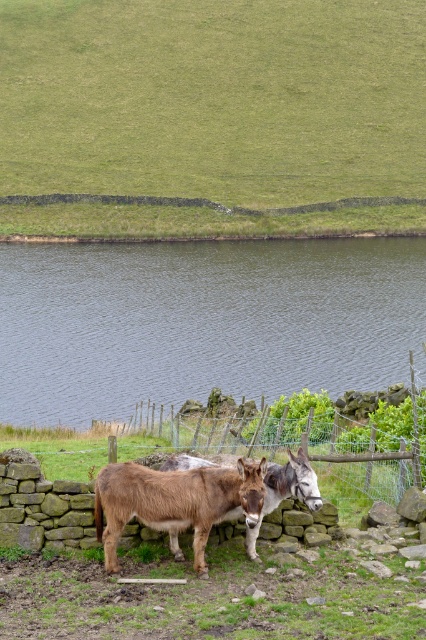
Who is positioned more to the right, brown fuzzy mule at center or brown fuzzy donkey at center?

From the viewer's perspective, brown fuzzy donkey at center appears more on the right side.

Can you confirm if brown fuzzy mule at center is taller than brown fuzzy donkey at center?

Indeed, brown fuzzy mule at center has a greater height compared to brown fuzzy donkey at center.

The width and height of the screenshot is (426, 640). What do you see at coordinates (175, 500) in the screenshot?
I see `brown fuzzy mule at center` at bounding box center [175, 500].

You are a GUI agent. You are given a task and a screenshot of the screen. Output one action in this format:
    pyautogui.click(x=<x>, y=<y>)
    Task: Click on the brown fuzzy mule at center
    The height and width of the screenshot is (640, 426).
    Given the screenshot: What is the action you would take?
    pyautogui.click(x=175, y=500)

Can you confirm if green grass at upper center is smaller than brown fuzzy donkey at center?

No, green grass at upper center is not smaller than brown fuzzy donkey at center.

The height and width of the screenshot is (640, 426). I want to click on green grass at upper center, so click(213, 115).

Looking at this image, who is positioned more to the right, wire mesh fence at center or brown fuzzy donkey at center?

Positioned to the right is wire mesh fence at center.

Is wire mesh fence at center in front of brown fuzzy donkey at center?

No, wire mesh fence at center is further to the viewer.

Is point (359, 493) positioned before point (181, 557)?

That is False.

The image size is (426, 640). I want to click on wire mesh fence at center, so click(374, 477).